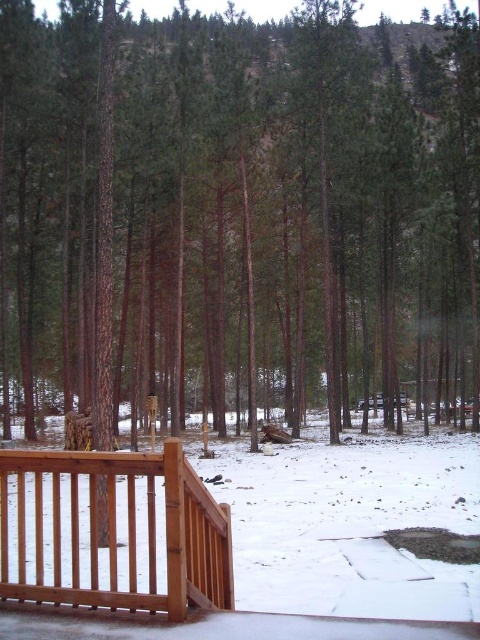
Question: Is brown wood tree at center smaller than brown wooden porch at lower left?

Choices:
 (A) yes
 (B) no

Answer: (B)

Question: Which object is the closest to the brown wooden porch at lower left?

Choices:
 (A) brown wood tree at center
 (B) wooden railing at lower left

Answer: (B)

Question: Estimate the real-world distances between objects in this image. Which object is farther from the brown wood tree at center?

Choices:
 (A) brown wooden porch at lower left
 (B) wooden railing at lower left

Answer: (B)

Question: Is brown wood tree at center below wooden railing at lower left?

Choices:
 (A) no
 (B) yes

Answer: (A)

Question: Considering the real-world distances, which object is farthest from the wooden railing at lower left?

Choices:
 (A) brown wood tree at center
 (B) brown wooden porch at lower left

Answer: (A)

Question: Observing the image, what is the correct spatial positioning of brown wooden porch at lower left in reference to wooden railing at lower left?

Choices:
 (A) left
 (B) right

Answer: (B)